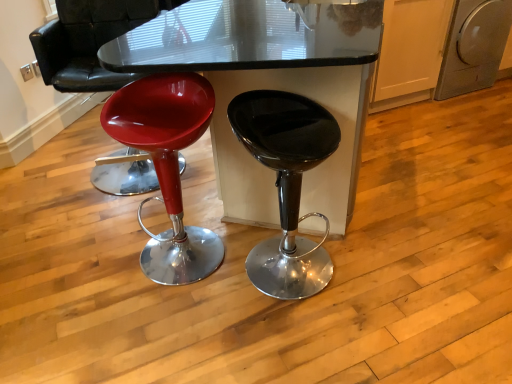
Find the location of a particular element. glossy black stool at center, the first stool positioned from the right is located at coordinates (286, 185).

Where is `glossy glass table at center`? Image resolution: width=512 pixels, height=384 pixels. glossy glass table at center is located at coordinates (268, 86).

What do you see at coordinates (89, 41) in the screenshot? This screenshot has height=384, width=512. I see `glossy plastic stool at left` at bounding box center [89, 41].

The width and height of the screenshot is (512, 384). I want to click on glossy plastic stool at left, which is the 2th stool in right-to-left order, so click(x=166, y=166).

Locate an element on the screen. glossy black stool at center, the first stool positioned from the right is located at coordinates click(x=286, y=185).

Is glossy plastic stool at left oriented towards silver metallic dishwasher at right?

No, glossy plastic stool at left is not aimed at silver metallic dishwasher at right.

From the picture: How many degrees apart are the facing directions of glossy plastic stool at left and silver metallic dishwasher at right?

The facing directions of glossy plastic stool at left and silver metallic dishwasher at right are 21.1 degrees apart.

Between glossy plastic stool at left and silver metallic dishwasher at right, which one appears on the right side from the viewer's perspective?

Positioned to the right is silver metallic dishwasher at right.

Is the depth of glossy black stool at center, arranged as the 2th stool when viewed from the left, less than that of silver metallic dishwasher at right?

Yes, glossy black stool at center, arranged as the 2th stool when viewed from the left, is closer to the camera.

Does glossy black stool at center, the first stool positioned from the right, have a greater width compared to silver metallic dishwasher at right?

No, glossy black stool at center, the first stool positioned from the right, is not wider than silver metallic dishwasher at right.

Locate an element on the screen. This screenshot has height=384, width=512. dish washer below the glossy black stool at center, arranged as the 2th stool when viewed from the left (from a real-world perspective) is located at coordinates (474, 46).

Considering the relative sizes of glossy glass table at center and glossy plastic stool at left in the image provided, is glossy glass table at center shorter than glossy plastic stool at left?

Indeed, glossy glass table at center has a lesser height compared to glossy plastic stool at left.

In the scene shown: Would you say glossy plastic stool at left is part of glossy glass table at center's contents?

No, glossy plastic stool at left is not surrounded by glossy glass table at center.

In the scene shown: Is glossy glass table at center not close to glossy plastic stool at left?

Yes, glossy glass table at center and glossy plastic stool at left are located far from each other.

From a real-world perspective, does glossy glass table at center sit lower than glossy plastic stool at left?

Yes.

From the image's perspective, between glossy plastic stool at left, which is the 2th stool in right-to-left order, and silver metallic dishwasher at right, which one is located above?

silver metallic dishwasher at right is shown above in the image.

Which object is positioned more to the right, glossy plastic stool at left, which is the 2th stool in right-to-left order, or silver metallic dishwasher at right?

silver metallic dishwasher at right is more to the right.

Is glossy plastic stool at left, the first stool viewed from the left, wider than silver metallic dishwasher at right?

No.

Is glossy plastic stool at left, which is the 2th stool in right-to-left order, behind silver metallic dishwasher at right?

No.

From the image's perspective, is glossy glass table at center positioned above or below glossy plastic stool at left, which is the 2th stool in right-to-left order?

glossy glass table at center is situated higher than glossy plastic stool at left, which is the 2th stool in right-to-left order, in the image.

Are glossy glass table at center and glossy plastic stool at left, the first stool viewed from the left, beside each other?

glossy glass table at center and glossy plastic stool at left, the first stool viewed from the left, are not in contact.

Is glossy glass table at center positioned with its back to glossy plastic stool at left, which is the 2th stool in right-to-left order?

No, glossy plastic stool at left, which is the 2th stool in right-to-left order, is not at the back of glossy glass table at center.

Who is taller, glossy glass table at center or glossy plastic stool at left, which is the 2th stool in right-to-left order?

Standing taller between the two is glossy glass table at center.

Based on their sizes in the image, would you say glossy plastic stool at left is bigger or smaller than glossy plastic stool at left, which is the 2th stool in right-to-left order?

In the image, glossy plastic stool at left appears to be larger than glossy plastic stool at left, which is the 2th stool in right-to-left order.

Where is `chair above the glossy plastic stool at left, which is the 2th stool in right-to-left order (from a real-world perspective)`? The width and height of the screenshot is (512, 384). chair above the glossy plastic stool at left, which is the 2th stool in right-to-left order (from a real-world perspective) is located at coordinates (89, 41).

Is point (103, 11) closer to camera compared to point (207, 123)?

No, (103, 11) is further to viewer.

Is glossy plastic stool at left not within glossy plastic stool at left, the first stool viewed from the left?

That's correct, glossy plastic stool at left is outside of glossy plastic stool at left, the first stool viewed from the left.

Between glossy glass table at center and glossy black stool at center, the first stool positioned from the right, which one has smaller size?

With smaller size is glossy black stool at center, the first stool positioned from the right.

From a real-world perspective, is glossy glass table at center above or below glossy black stool at center, the first stool positioned from the right?

glossy glass table at center is above glossy black stool at center, the first stool positioned from the right.

Could you tell me if glossy glass table at center is turned towards glossy black stool at center, the first stool positioned from the right?

No, glossy glass table at center does not turn towards glossy black stool at center, the first stool positioned from the right.

What's the angular difference between glossy glass table at center and glossy black stool at center, arranged as the 2th stool when viewed from the left,'s facing directions?

glossy glass table at center and glossy black stool at center, arranged as the 2th stool when viewed from the left, are facing 88.9 degrees away from each other.

At what (x,y) coordinates should I click in order to perform the action: click on chair above the silver metallic dishwasher at right (from a real-world perspective). Please return your answer as a coordinate pair (x, y). Looking at the image, I should click on (89, 41).

The image size is (512, 384). I want to click on dish washer that appears above the glossy black stool at center, arranged as the 2th stool when viewed from the left (from the image's perspective), so click(474, 46).

Which object lies further to the anchor point glossy plastic stool at left, glossy glass table at center or glossy plastic stool at left, the first stool viewed from the left?

glossy glass table at center lies further to glossy plastic stool at left than the other object.

Looking at the image, which one is located further to silver metallic dishwasher at right, glossy black stool at center, the first stool positioned from the right, or glossy plastic stool at left?

glossy plastic stool at left lies further to silver metallic dishwasher at right than the other object.

From the image, which object appears to be nearer to silver metallic dishwasher at right, glossy glass table at center or glossy plastic stool at left?

glossy glass table at center.

Based on their spatial positions, is glossy plastic stool at left or glossy plastic stool at left, which is the 2th stool in right-to-left order, further from glossy glass table at center?

glossy plastic stool at left, which is the 2th stool in right-to-left order.

Which object lies further to the anchor point glossy black stool at center, the first stool positioned from the right, glossy plastic stool at left or glossy plastic stool at left, which is the 2th stool in right-to-left order?

glossy plastic stool at left is further to glossy black stool at center, the first stool positioned from the right.

When comparing their distances from glossy plastic stool at left, does glossy black stool at center, the first stool positioned from the right, or glossy plastic stool at left, which is the 2th stool in right-to-left order, seem closer?

Based on the image, glossy plastic stool at left, which is the 2th stool in right-to-left order, appears to be nearer to glossy plastic stool at left.

Which object lies nearer to the anchor point glossy black stool at center, the first stool positioned from the right, glossy plastic stool at left, which is the 2th stool in right-to-left order, or glossy glass table at center?

glossy plastic stool at left, which is the 2th stool in right-to-left order, is closer to glossy black stool at center, the first stool positioned from the right.

Based on their spatial positions, is glossy plastic stool at left, which is the 2th stool in right-to-left order, or glossy plastic stool at left further from glossy black stool at center, the first stool positioned from the right?

Among the two, glossy plastic stool at left is located further to glossy black stool at center, the first stool positioned from the right.

Where is `stool located between glossy plastic stool at left and glossy black stool at center, the first stool positioned from the right, in the left-right direction`? The height and width of the screenshot is (384, 512). stool located between glossy plastic stool at left and glossy black stool at center, the first stool positioned from the right, in the left-right direction is located at coordinates (166, 166).

This screenshot has width=512, height=384. Identify the location of table between glossy black stool at center, the first stool positioned from the right, and silver metallic dishwasher at right, along the z-axis. (268, 86).

Locate an element on the screen. This screenshot has width=512, height=384. stool located between glossy plastic stool at left, which is the 2th stool in right-to-left order, and silver metallic dishwasher at right in the left-right direction is located at coordinates (286, 185).

Where is `stool located between glossy plastic stool at left and glossy glass table at center in the left-right direction`? The width and height of the screenshot is (512, 384). stool located between glossy plastic stool at left and glossy glass table at center in the left-right direction is located at coordinates (166, 166).